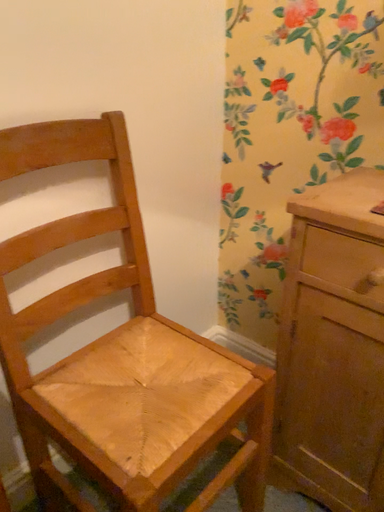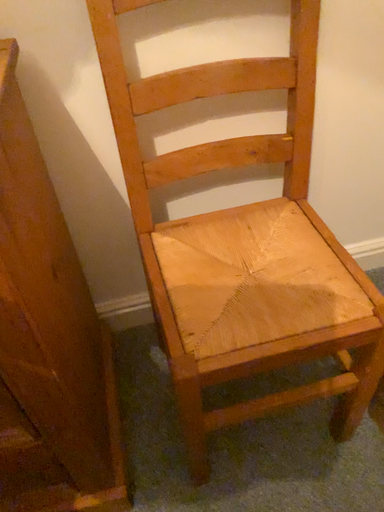
Question: Which way did the camera rotate in the video?

Choices:
 (A) rotated downward
 (B) rotated upward

Answer: (A)